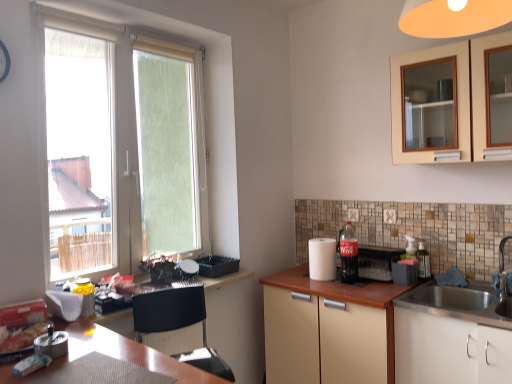
Question: Is white paper towel at center, which appears as the second appliance when viewed from the right, further to camera compared to white glossy sink at lower right, marked as the second cabinetry in a left-to-right arrangement?

Choices:
 (A) yes
 (B) no

Answer: (A)

Question: Is white paper towel at center, which appears as the 1th appliance when viewed from the left, surrounding white glossy sink at lower right, marked as the second cabinetry in a left-to-right arrangement?

Choices:
 (A) yes
 (B) no

Answer: (B)

Question: Is white paper towel at center, which appears as the 1th appliance when viewed from the left, far from white glossy sink at lower right, marked as the first cabinetry in a right-to-left arrangement?

Choices:
 (A) yes
 (B) no

Answer: (B)

Question: Does white paper towel at center, which appears as the second appliance when viewed from the right, have a greater width compared to white glossy sink at lower right, marked as the first cabinetry in a right-to-left arrangement?

Choices:
 (A) no
 (B) yes

Answer: (A)

Question: Is white paper towel at center, which appears as the second appliance when viewed from the right, thinner than white glossy sink at lower right, marked as the first cabinetry in a right-to-left arrangement?

Choices:
 (A) no
 (B) yes

Answer: (B)

Question: From the image's perspective, relative to red glass coca-cola bottle at center-right, is transparent plastic bottle at right above or below?

Choices:
 (A) below
 (B) above

Answer: (A)

Question: Is transparent plastic bottle at right in front of or behind red glass coca-cola bottle at center-right in the image?

Choices:
 (A) front
 (B) behind

Answer: (B)

Question: Considering the positions of transparent plastic bottle at right and red glass coca-cola bottle at center-right in the image, is transparent plastic bottle at right taller or shorter than red glass coca-cola bottle at center-right?

Choices:
 (A) tall
 (B) short

Answer: (B)

Question: Would you say transparent plastic bottle at right is inside or outside red glass coca-cola bottle at center-right?

Choices:
 (A) outside
 (B) inside

Answer: (A)

Question: Looking at their shapes, would you say black plastic chair at lower left is wider or thinner than white glossy sink at lower right, marked as the second cabinetry in a left-to-right arrangement?

Choices:
 (A) thin
 (B) wide

Answer: (A)

Question: Considering the positions of black plastic chair at lower left and white glossy sink at lower right, marked as the first cabinetry in a right-to-left arrangement, in the image, is black plastic chair at lower left taller or shorter than white glossy sink at lower right, marked as the first cabinetry in a right-to-left arrangement,?

Choices:
 (A) tall
 (B) short

Answer: (B)

Question: Is black plastic chair at lower left in front of or behind white glossy sink at lower right, marked as the first cabinetry in a right-to-left arrangement, in the image?

Choices:
 (A) behind
 (B) front

Answer: (B)

Question: Visually, is black plastic chair at lower left positioned to the left or to the right of white glossy sink at lower right, marked as the first cabinetry in a right-to-left arrangement?

Choices:
 (A) right
 (B) left

Answer: (B)

Question: From the image's perspective, is white paper towel at center, which appears as the second appliance when viewed from the right, located above or below red glass coca-cola bottle at center-right?

Choices:
 (A) above
 (B) below

Answer: (B)

Question: Choose the correct answer: Is white paper towel at center, which appears as the 1th appliance when viewed from the left, inside red glass coca-cola bottle at center-right or outside it?

Choices:
 (A) outside
 (B) inside

Answer: (A)